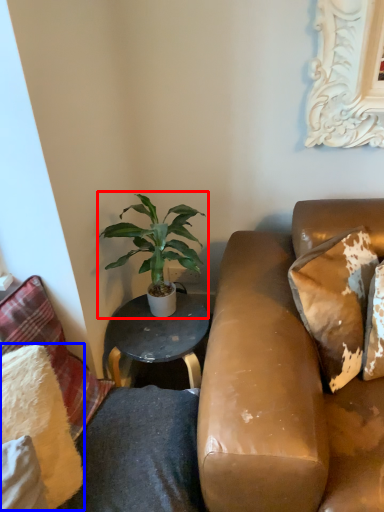
Question: Which object is further to the camera taking this photo, houseplant (highlighted by a red box) or pillow (highlighted by a blue box)?

Choices:
 (A) houseplant
 (B) pillow

Answer: (A)